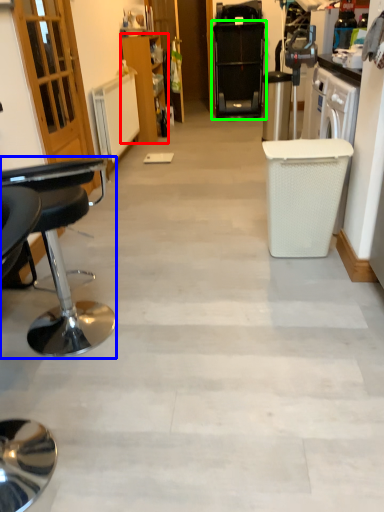
Question: Considering the real-world distances, which object is farthest from cabinetry (highlighted by a red box)? chair (highlighted by a blue box) or home appliance (highlighted by a green box)?

Choices:
 (A) chair
 (B) home appliance

Answer: (A)